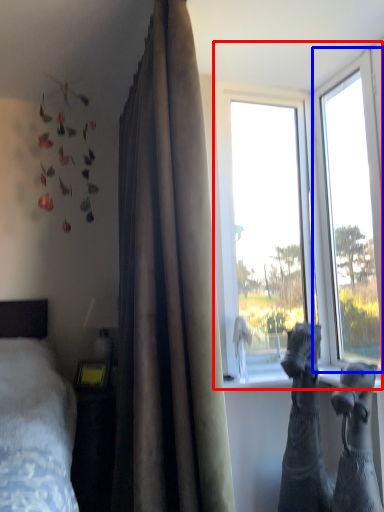
Question: Which of the following is the farthest to the observer, window (highlighted by a red box) or window (highlighted by a blue box)?

Choices:
 (A) window
 (B) window

Answer: (A)